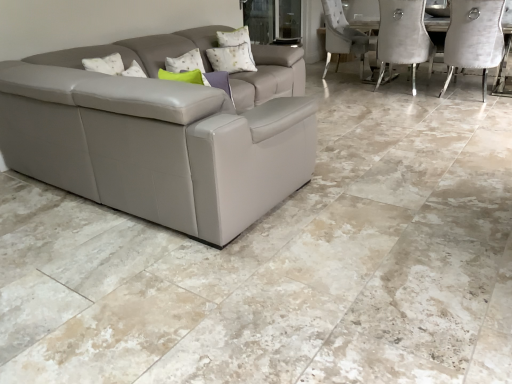
Find the location of a particular element. The height and width of the screenshot is (384, 512). unoccupied space behind velvet grey chair at upper right is located at coordinates (445, 84).